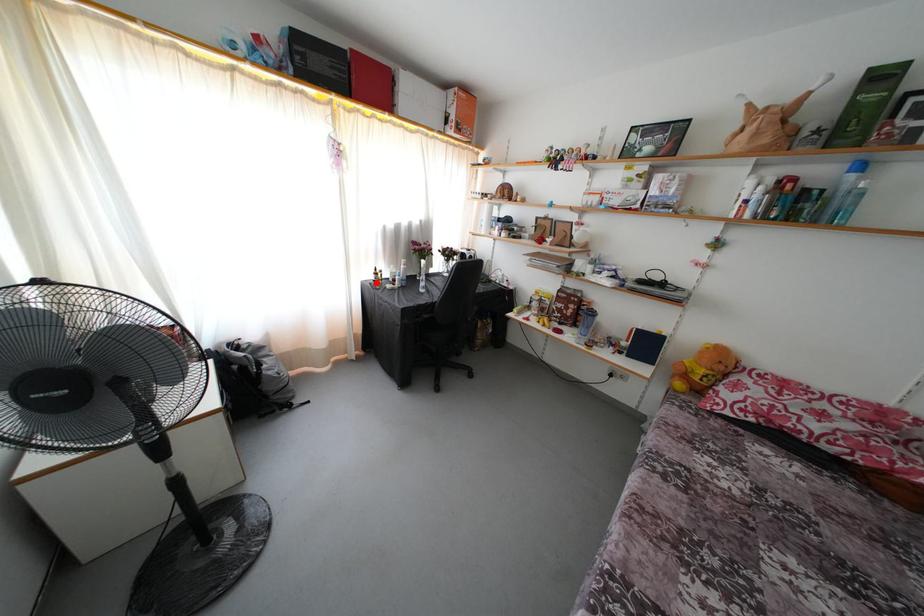
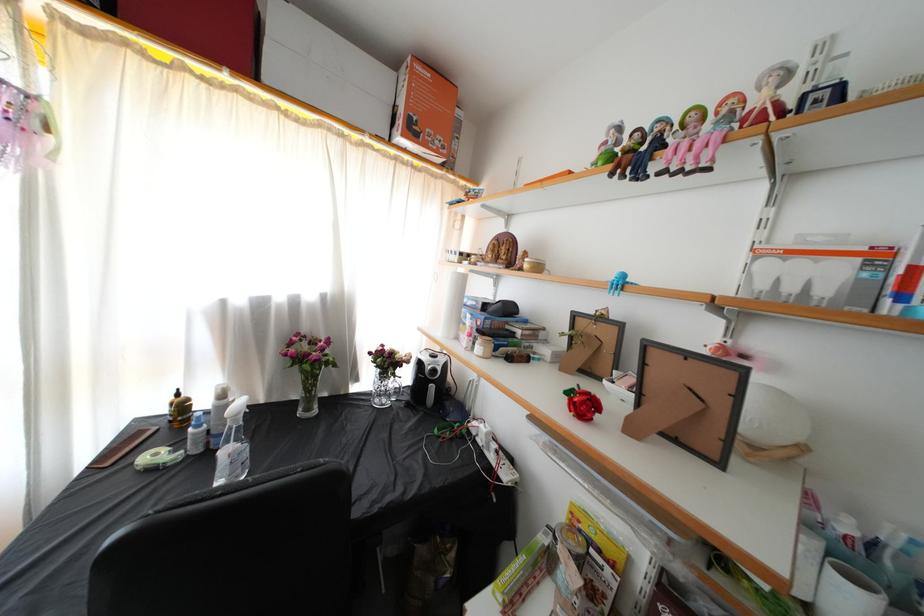
Question: I am providing you with two images of the same scene from different viewpoints. A red point is marked on the first image. Is the red point's position out of view in image 2?

Choices:
 (A) Yes
 (B) No

Answer: (B)